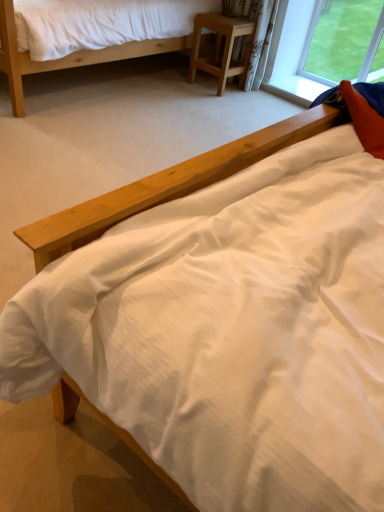
Question: Is matte wood bed at upper left positioned before light brown wood at center?

Choices:
 (A) no
 (B) yes

Answer: (B)

Question: Is matte wood bed at upper left further to camera compared to light brown wood at center?

Choices:
 (A) yes
 (B) no

Answer: (B)

Question: Is matte wood bed at upper left wider than light brown wood at center?

Choices:
 (A) yes
 (B) no

Answer: (A)

Question: Is there a large distance between matte wood bed at upper left and light brown wood at center?

Choices:
 (A) yes
 (B) no

Answer: (B)

Question: Is matte wood bed at upper left to the left of light brown wood at center from the viewer's perspective?

Choices:
 (A) yes
 (B) no

Answer: (A)

Question: Is matte wood bed at upper left bigger than light brown wood at center?

Choices:
 (A) yes
 (B) no

Answer: (A)

Question: Can you confirm if light brown wood at center is shorter than matte wood bed at upper left?

Choices:
 (A) no
 (B) yes

Answer: (B)

Question: Is light brown wood at center closer to camera compared to matte wood bed at upper left?

Choices:
 (A) yes
 (B) no

Answer: (B)

Question: Considering the relative sizes of light brown wood at center and matte wood bed at upper left in the image provided, is light brown wood at center wider than matte wood bed at upper left?

Choices:
 (A) yes
 (B) no

Answer: (B)

Question: From the image's perspective, is light brown wood at center located beneath matte wood bed at upper left?

Choices:
 (A) no
 (B) yes

Answer: (B)

Question: From the image's perspective, is light brown wood at center on matte wood bed at upper left?

Choices:
 (A) no
 (B) yes

Answer: (A)

Question: Considering the relative positions of light brown wood at center and matte wood bed at upper left in the image provided, is light brown wood at center to the left of matte wood bed at upper left from the viewer's perspective?

Choices:
 (A) no
 (B) yes

Answer: (A)

Question: Considering the positions of matte wood bed at upper left and light brown wood at center in the image, is matte wood bed at upper left bigger or smaller than light brown wood at center?

Choices:
 (A) small
 (B) big

Answer: (B)